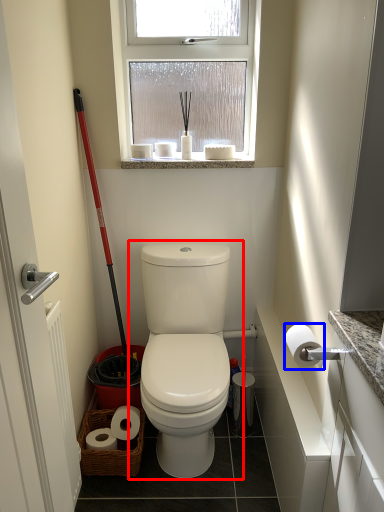
Question: Which point is closer to the camera, toilet (highlighted by a red box) or toilet paper (highlighted by a blue box)?

Choices:
 (A) toilet
 (B) toilet paper

Answer: (B)